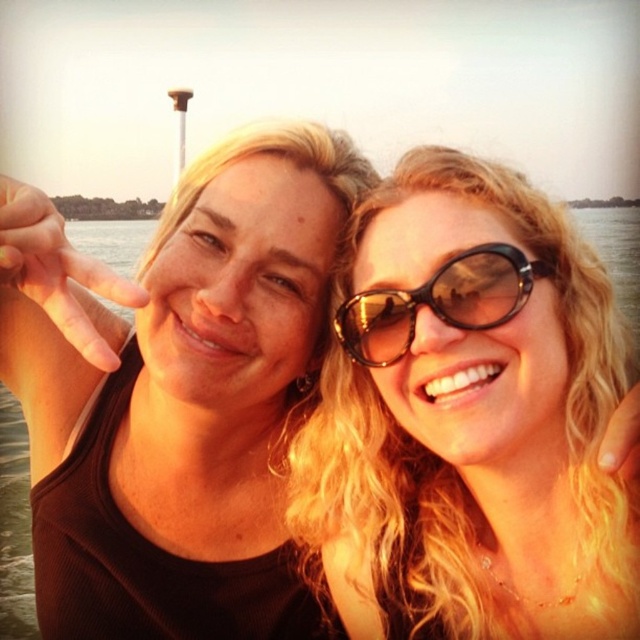
Is the position of transparent water at center less distant than that of black plastic sunglasses at center?

Yes, it is.

From the picture: Is transparent water at center below black plastic sunglasses at center?

No, transparent water at center is not below black plastic sunglasses at center.

Where is `transparent water at center`? transparent water at center is located at coordinates (12, 525).